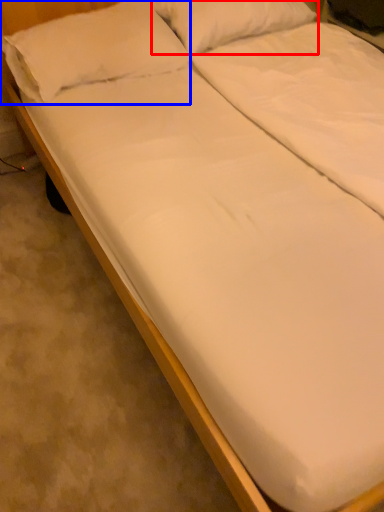
Question: Which object is further to the camera taking this photo, pillow (highlighted by a red box) or pillow (highlighted by a blue box)?

Choices:
 (A) pillow
 (B) pillow

Answer: (A)